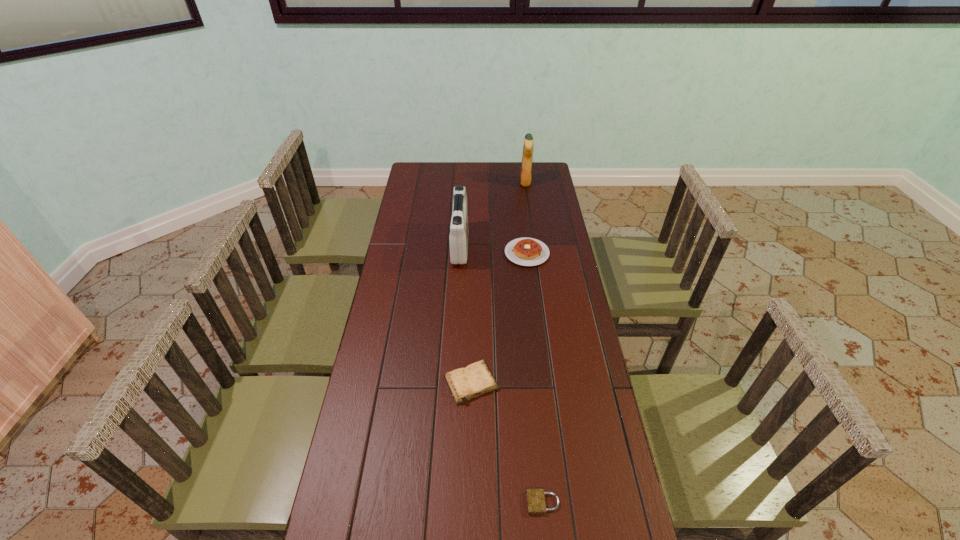
This screenshot has height=540, width=960. I want to click on vacant region at the far edge of the desktop, so click(453, 170).

Image resolution: width=960 pixels, height=540 pixels. What are the coordinates of `free space at the left edge` in the screenshot? It's located at (404, 214).

Where is `vacant space at the right edge of the desktop`? Image resolution: width=960 pixels, height=540 pixels. vacant space at the right edge of the desktop is located at coordinates (578, 346).

You are a GUI agent. You are given a task and a screenshot of the screen. Output one action in this format:
    pyautogui.click(x=<x>, y=<y>)
    Task: Click on the vacant space at the far right corner of the desktop
    
    Given the screenshot: What is the action you would take?
    pyautogui.click(x=532, y=173)

Locate an element on the screen. This screenshot has height=540, width=960. free space between the farthest object and the second shortest object is located at coordinates (498, 282).

You are a GUI agent. You are given a task and a screenshot of the screen. Output one action in this format:
    pyautogui.click(x=<x>, y=<y>)
    Task: Click on the empty location between the pancake and the second shortest object
    This screenshot has height=540, width=960.
    Given the screenshot: What is the action you would take?
    pyautogui.click(x=499, y=318)

The height and width of the screenshot is (540, 960). I want to click on vacant area between the detergent and the second tallest object, so tap(492, 214).

You are a GUI agent. You are given a task and a screenshot of the screen. Output one action in this format:
    pyautogui.click(x=<x>, y=<y>)
    Task: Click on the empty space that is in between the third tallest object and the diary
    
    Given the screenshot: What is the action you would take?
    pyautogui.click(x=499, y=318)

I want to click on vacant area that lies between the third shortest object and the fourth shortest object, so click(x=493, y=249).

The width and height of the screenshot is (960, 540). I want to click on vacant space that's between the diary and the fourth shortest object, so click(x=466, y=314).